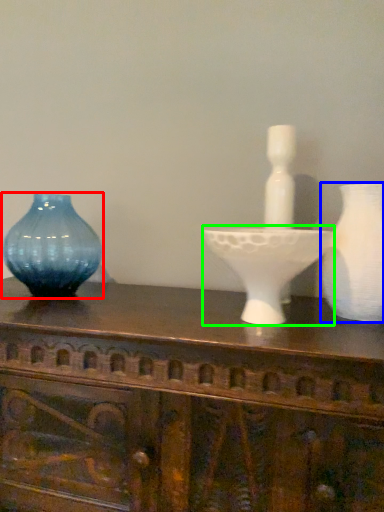
Question: Which is farther away from vase (highlighted by a red box)? vase (highlighted by a blue box) or candle holder (highlighted by a green box)?

Choices:
 (A) vase
 (B) candle holder

Answer: (A)